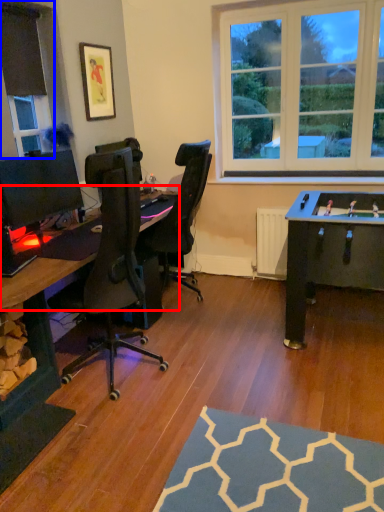
Question: Which object appears farthest to the camera in this image, computer desk (highlighted by a red box) or window frame (highlighted by a blue box)?

Choices:
 (A) computer desk
 (B) window frame

Answer: (B)